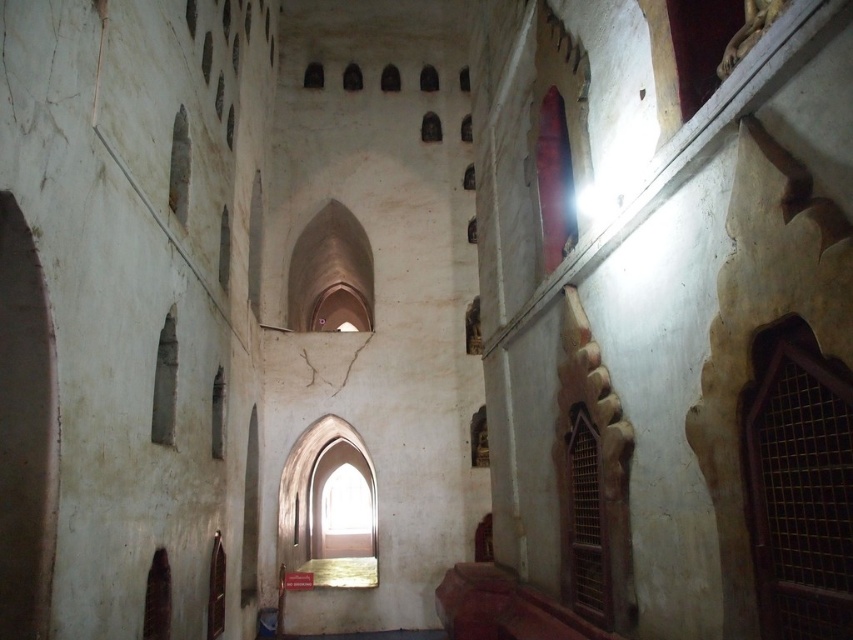
Question: Does brown wooden lattice at right appear on the right side of transparent glass window at center?

Choices:
 (A) no
 (B) yes

Answer: (B)

Question: Can you confirm if smooth stone window at upper left is thinner than transparent glass window at lower left?

Choices:
 (A) yes
 (B) no

Answer: (B)

Question: Where is gold metallic arch at center located in relation to smooth stone window at upper left in the image?

Choices:
 (A) below
 (B) above

Answer: (A)

Question: Which object is positioned closest to the smooth stone window at left?

Choices:
 (A) smooth stone window at upper left
 (B) brown wooden window at lower right
 (C) brown wooden lattice at right
 (D) transparent glass window at center

Answer: (A)

Question: Among these objects, which one is nearest to the camera?

Choices:
 (A) smooth stone window at upper left
 (B) gold metallic arch at center
 (C) brown wooden lattice at right

Answer: (C)

Question: Estimate the real-world distances between objects in this image. Which object is closer to the transparent glass window at center?

Choices:
 (A) smooth stone window at left
 (B) transparent glass window at lower left
 (C) brown wooden lattice at right

Answer: (B)